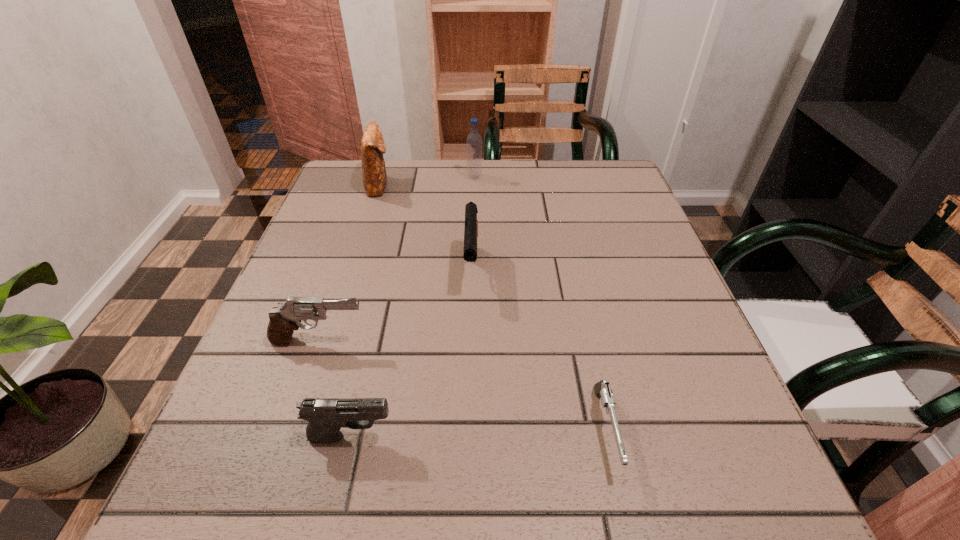
I want to click on free space between the clutch bag and the fourth nearest object, so click(425, 228).

Identify the location of free space between the rightmost pistol and the water bottle. (540, 303).

Identify the location of vacant area that lies between the third tallest pistol and the farthest pistol. (412, 354).

Locate an element on the screen. vacant space that's between the third nearest object and the third tallest pistol is located at coordinates (335, 389).

Where is `free space between the rightmost pistol and the third nearest object`? This screenshot has height=540, width=960. free space between the rightmost pistol and the third nearest object is located at coordinates (463, 386).

Where is `blank region between the second farthest pistol and the third tallest pistol`? blank region between the second farthest pistol and the third tallest pistol is located at coordinates (335, 389).

Locate which object is the fifth closest to the water bottle. Please provide its 2D coordinates. Your answer should be formatted as a tuple, i.e. [(x, y)], where the tuple contains the x and y coordinates of a point satisfying the conditions above.

[(326, 416)]

Identify the location of object that is the fourth closest one to the water bottle. (602, 389).

Locate which pistol is the third closest to the farthest pistol. Please provide its 2D coordinates. Your answer should be formatted as a tuple, i.e. [(x, y)], where the tuple contains the x and y coordinates of a point satisfying the conditions above.

[(326, 416)]

Select which pistol is the third closest to the second shortest object. Please provide its 2D coordinates. Your answer should be formatted as a tuple, i.e. [(x, y)], where the tuple contains the x and y coordinates of a point satisfying the conditions above.

[(602, 389)]